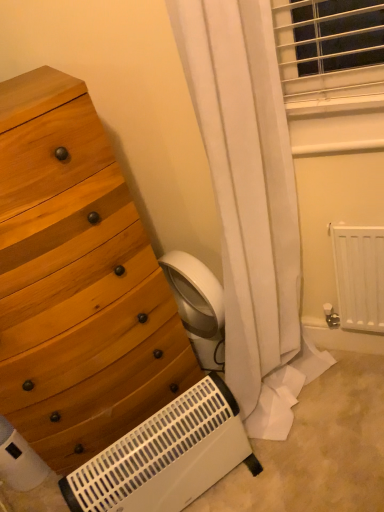
Measure the distance between wooden chest of drawers at left and camera.

A distance of 35.09 inches exists between wooden chest of drawers at left and camera.

At what (x,y) coordinates should I click in order to perform the action: click on white matte radiator at lower right. Please return your answer as a coordinate pair (x, y). This screenshot has height=512, width=384. Looking at the image, I should click on pos(359,276).

Find the location of a particular element. The width and height of the screenshot is (384, 512). wooden chest of drawers at left is located at coordinates (77, 281).

Considering the sizes of white plastic heater at lower center and white matte radiator at lower right in the image, is white plastic heater at lower center taller or shorter than white matte radiator at lower right?

In the image, white plastic heater at lower center appears to be shorter than white matte radiator at lower right.

Considering the relative positions of white plastic heater at lower center and white matte radiator at lower right in the image provided, is white plastic heater at lower center in front of white matte radiator at lower right?

Yes, the depth of white plastic heater at lower center is less than that of white matte radiator at lower right.

You are a GUI agent. You are given a task and a screenshot of the screen. Output one action in this format:
    pyautogui.click(x=<x>, y=<y>)
    Task: Click on the radiator behind the white plastic heater at lower center
    The height and width of the screenshot is (512, 384).
    Given the screenshot: What is the action you would take?
    click(359, 276)

Between white plastic heater at lower center and white matte radiator at lower right, which one has smaller width?

Thinner between the two is white matte radiator at lower right.

Is white plastic heater at lower center bigger than wooden chest of drawers at left?

Incorrect, white plastic heater at lower center is not larger than wooden chest of drawers at left.

Would you consider white plastic heater at lower center to be distant from wooden chest of drawers at left?

No, white plastic heater at lower center is in close proximity to wooden chest of drawers at left.

Consider the image. Is wooden chest of drawers at left in contact with white matte radiator at lower right?

No.

Can you tell me how much wooden chest of drawers at left and white matte radiator at lower right differ in facing direction?

51.6 degrees.

From the image's perspective, does wooden chest of drawers at left appear higher than white matte radiator at lower right?

No, from the image's perspective, wooden chest of drawers at left is not over white matte radiator at lower right.

Is wooden chest of drawers at left oriented away from white matte radiator at lower right?

No, wooden chest of drawers at left's orientation is not away from white matte radiator at lower right.

In the scene shown: Which of these two, white matte radiator at lower right or white plastic heater at lower center, is bigger?

white plastic heater at lower center.

From the image's perspective, which is above, white matte radiator at lower right or white plastic heater at lower center?

white matte radiator at lower right appears higher in the image.

Which object is positioned more to the right, white matte radiator at lower right or white plastic heater at lower center?

white matte radiator at lower right is more to the right.

Is white matte radiator at lower right not near white plastic heater at lower center?

No, there isn't a large distance between white matte radiator at lower right and white plastic heater at lower center.

Considering the sizes of wooden chest of drawers at left and white plastic heater at lower center in the image, is wooden chest of drawers at left taller or shorter than white plastic heater at lower center?

Considering their sizes, wooden chest of drawers at left has more height than white plastic heater at lower center.

Is wooden chest of drawers at left inside the boundaries of white plastic heater at lower center, or outside?

The correct answer is: outside.

Looking at this image, is white plastic heater at lower center at the back of wooden chest of drawers at left?

No, wooden chest of drawers at left is not facing the opposite direction of white plastic heater at lower center.

How many degrees apart are the facing directions of wooden chest of drawers at left and white plastic heater at lower center?

wooden chest of drawers at left and white plastic heater at lower center are facing 2.87 degrees away from each other.

Which object is closer to the camera taking this photo, white matte radiator at lower right or wooden chest of drawers at left?

wooden chest of drawers at left is in front.

Is white matte radiator at lower right wider than wooden chest of drawers at left?

No, white matte radiator at lower right is not wider than wooden chest of drawers at left.

The image size is (384, 512). In the image, there is a wooden chest of drawers at left. In order to click on radiator below it (from a real-world perspective) in this screenshot , I will do point(359,276).

The width and height of the screenshot is (384, 512). Identify the location of heater located below the white matte radiator at lower right (from the image's perspective). (166, 456).

You are a GUI agent. You are given a task and a screenshot of the screen. Output one action in this format:
    pyautogui.click(x=<x>, y=<y>)
    Task: Click on the chest of drawers above the white plastic heater at lower center (from the image's perspective)
    
    Given the screenshot: What is the action you would take?
    pyautogui.click(x=77, y=281)

Considering their positions, is white plastic heater at lower center positioned further to wooden chest of drawers at left than white matte radiator at lower right?

The object further to wooden chest of drawers at left is white matte radiator at lower right.

From the image, which object appears to be nearer to wooden chest of drawers at left, white matte radiator at lower right or white plastic heater at lower center?

The object closer to wooden chest of drawers at left is white plastic heater at lower center.

Considering their positions, is white plastic heater at lower center positioned closer to white matte radiator at lower right than wooden chest of drawers at left?

Among the two, white plastic heater at lower center is located nearer to white matte radiator at lower right.

When comparing their distances from white matte radiator at lower right, does wooden chest of drawers at left or white plastic heater at lower center seem further?

Based on the image, wooden chest of drawers at left appears to be further to white matte radiator at lower right.

Based on the photo, based on their spatial positions, is wooden chest of drawers at left or white matte radiator at lower right further from white plastic heater at lower center?

Based on the image, white matte radiator at lower right appears to be further to white plastic heater at lower center.

When comparing their distances from white plastic heater at lower center, does white matte radiator at lower right or wooden chest of drawers at left seem closer?

Among the two, wooden chest of drawers at left is located nearer to white plastic heater at lower center.

This screenshot has width=384, height=512. Identify the location of heater located between wooden chest of drawers at left and white matte radiator at lower right in the left-right direction. (166, 456).